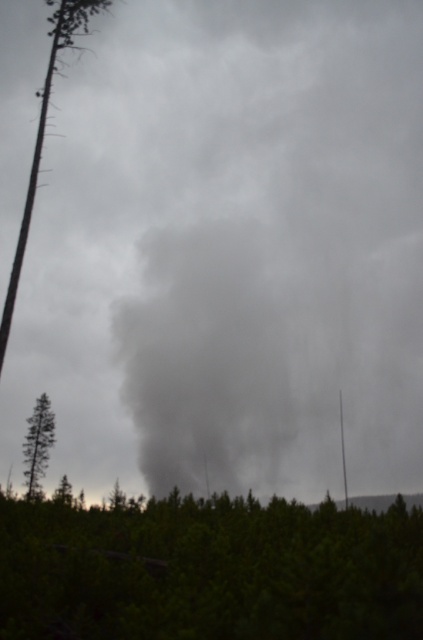
Looking at this image, measure the distance from green matte forest at lower center to green matte tree at left.

A distance of 15.41 meters exists between green matte forest at lower center and green matte tree at left.

The image size is (423, 640). What are the coordinates of `green matte forest at lower center` in the screenshot? It's located at (209, 570).

Identify the location of green matte forest at lower center. (209, 570).

Between point (376, 624) and point (87, 3), which one is positioned in front?

Point (376, 624) is in front.

Does green matte forest at lower center appear on the left side of smooth bark tree at left?

In fact, green matte forest at lower center is to the right of smooth bark tree at left.

Is point (211, 630) more distant than point (16, 259)?

That is False.

The width and height of the screenshot is (423, 640). I want to click on green matte forest at lower center, so click(209, 570).

Is smooth bark tree at left shorter than green matte tree at left?

No.

Which of these two, smooth bark tree at left or green matte tree at left, stands taller?

smooth bark tree at left is taller.

Which is in front, point (80, 48) or point (41, 452)?

Point (41, 452)

Image resolution: width=423 pixels, height=640 pixels. I want to click on smooth bark tree at left, so (x=43, y=129).